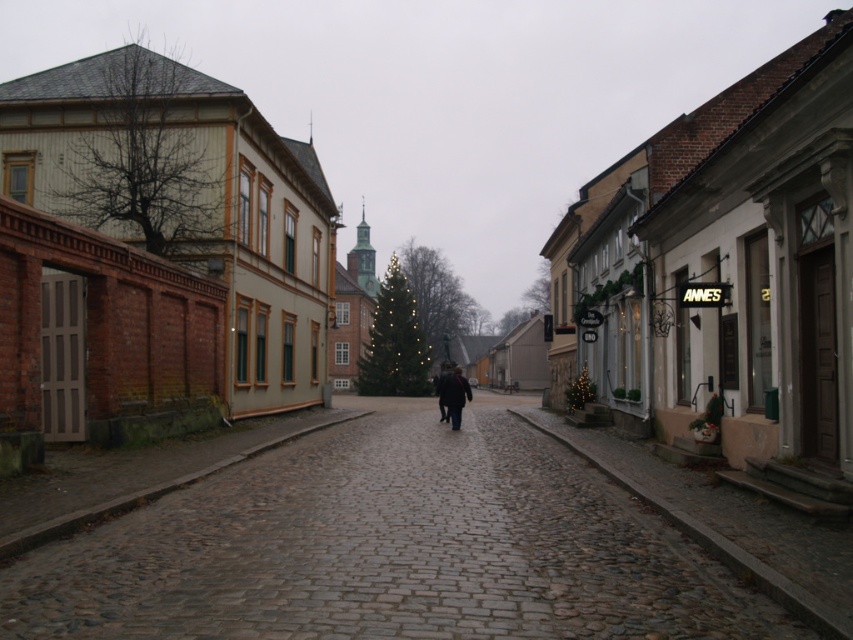
Question: Is the position of cobblestone street at center less distant than that of dark wool coat at center?

Choices:
 (A) no
 (B) yes

Answer: (B)

Question: Does cobblestone street at center appear under dark wool coat at center?

Choices:
 (A) yes
 (B) no

Answer: (A)

Question: Which point appears farthest from the camera in this image?

Choices:
 (A) (440, 387)
 (B) (306, 618)

Answer: (A)

Question: Does cobblestone street at center lie behind dark wool coat at center?

Choices:
 (A) yes
 (B) no

Answer: (B)